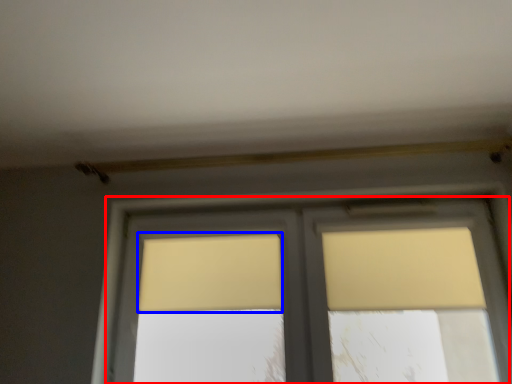
Question: Which point is further to the camera, window (highlighted by a red box) or curtain (highlighted by a blue box)?

Choices:
 (A) window
 (B) curtain

Answer: (B)